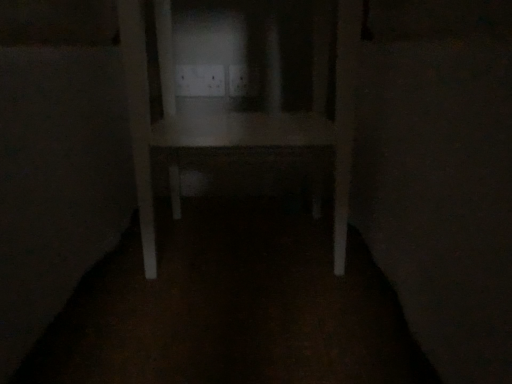
Question: Relative to white plastic electric outlet at center, the 2th electric outlet in the right-to-left sequence, is white plastic electric outlet at center, which appears as the first electric outlet when viewed from the right, in front or behind?

Choices:
 (A) behind
 (B) front

Answer: (B)

Question: Do you think white plastic electric outlet at center, positioned as the second electric outlet in left-to-right order, is within white plastic electric outlet at center, the 2th electric outlet in the right-to-left sequence, or outside of it?

Choices:
 (A) inside
 (B) outside

Answer: (B)

Question: Based on their relative distances, which object is farther from the white matte table at center?

Choices:
 (A) white plastic electric outlet at center, the 2th electric outlet in the right-to-left sequence
 (B) white plastic electric outlet at center, which appears as the first electric outlet when viewed from the right

Answer: (B)

Question: Estimate the real-world distances between objects in this image. Which object is closer to the white plastic electric outlet at center, the 2th electric outlet in the right-to-left sequence?

Choices:
 (A) white matte table at center
 (B) white plastic electric outlet at center, positioned as the second electric outlet in left-to-right order

Answer: (B)